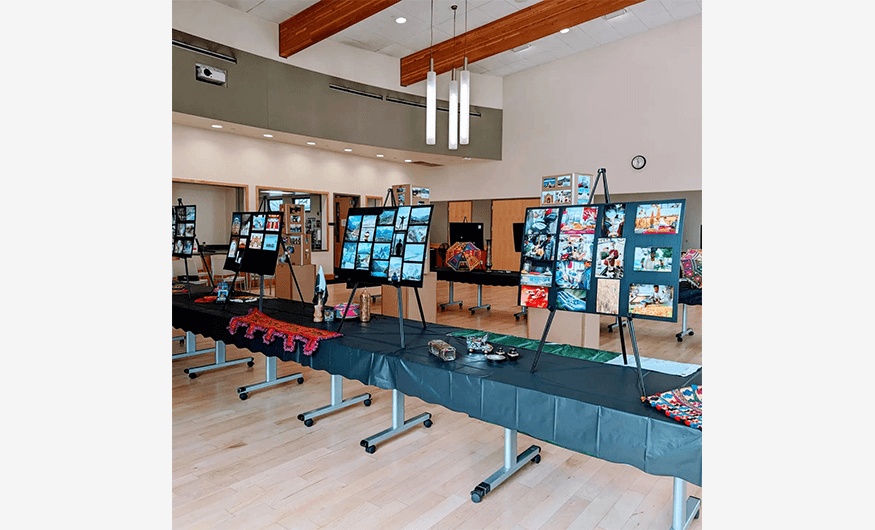
Find the location of a particular element. The image size is (875, 530). table is located at coordinates (583, 402).